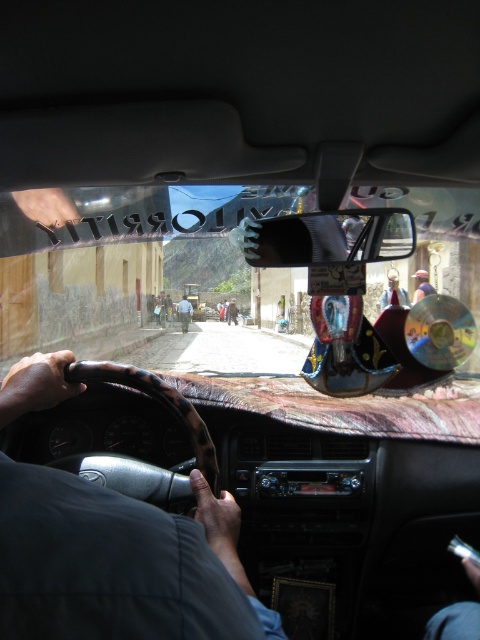
Question: Which point is farther from the camera taking this photo?

Choices:
 (A) (180, 310)
 (B) (179, 524)

Answer: (A)

Question: Among these points, which one is nearest to the camera?

Choices:
 (A) (47, 499)
 (B) (96, 244)
 (C) (188, 314)

Answer: (A)

Question: Is matte glass windshield at center to the right of light blue shirt at center from the viewer's perspective?

Choices:
 (A) yes
 (B) no

Answer: (A)

Question: Observing the image, what is the correct spatial positioning of black leather steering wheel at center in reference to light blue shirt at center?

Choices:
 (A) below
 (B) above

Answer: (A)

Question: Is black leather steering wheel at center smaller than light blue shirt at center?

Choices:
 (A) yes
 (B) no

Answer: (A)

Question: Which is farther from the matte glass windshield at center?

Choices:
 (A) light blue shirt at center
 (B) black leather steering wheel at center

Answer: (B)